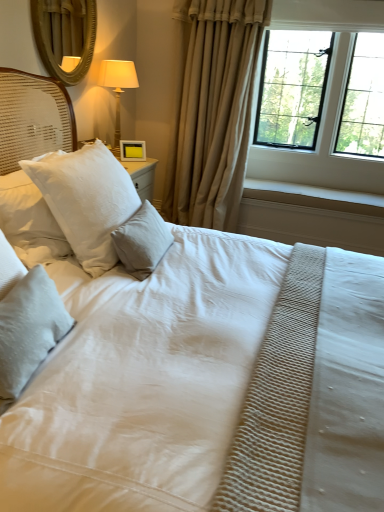
Question: Is white textured pillow at center, placed as the 3th pillow when sorted from front to back, situated inside black metal window at upper right or outside?

Choices:
 (A) outside
 (B) inside

Answer: (A)

Question: From the image's perspective, relative to black metal window at upper right, is white textured pillow at center, placed as the 3th pillow when sorted from front to back, above or below?

Choices:
 (A) above
 (B) below

Answer: (B)

Question: Based on their relative distances, which object is nearer to the gold textured mirror at upper left?

Choices:
 (A) white textured pillow at lower left, which is the first pillow from front to back
 (B) white textured pillow at center, placed as the 3th pillow when sorted from front to back
 (C) matte gold lamp at upper left
 (D) beige fabric curtain at center
 (E) white textured pillow at upper left, arranged as the 2th pillow when viewed from the back

Answer: (C)

Question: Which object is positioned closest to the beige fabric curtain at center?

Choices:
 (A) black metal window at upper right
 (B) white textured pillow at lower left, which is the first pillow from front to back
 (C) yellow matte picture frame at upper center
 (D) gold textured mirror at upper left
 (E) matte gold lamp at upper left

Answer: (A)